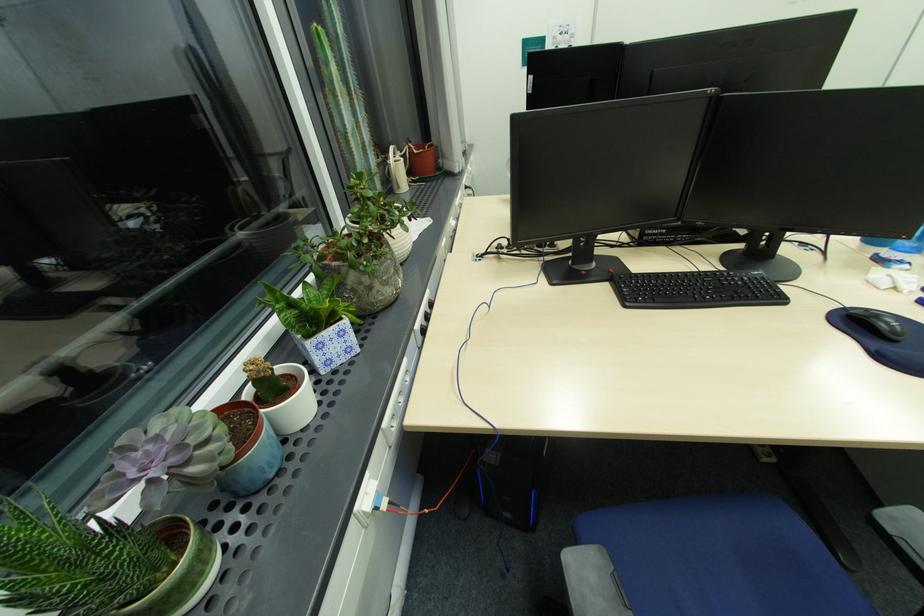
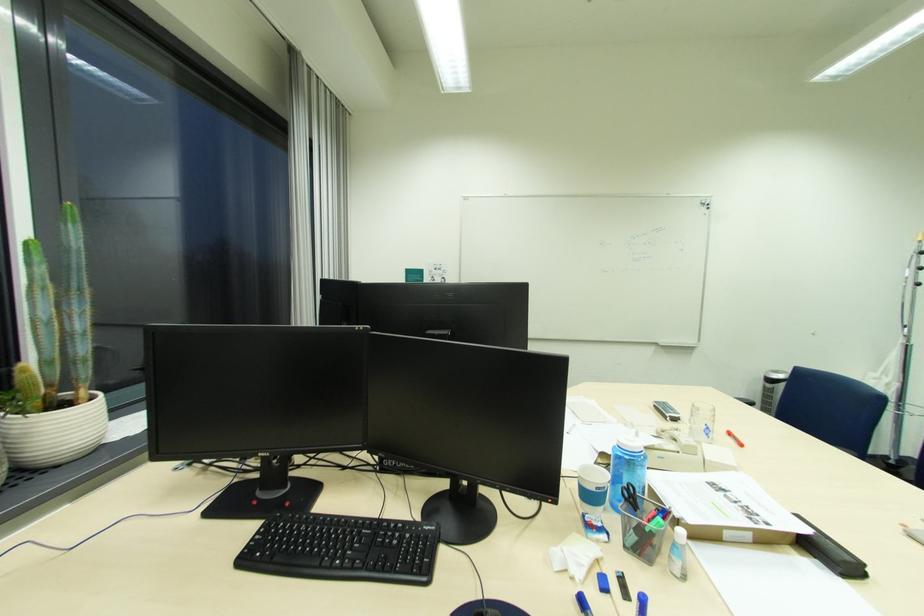
Find the pixel in the second image that matches point (743, 284) in the first image.

(396, 541)